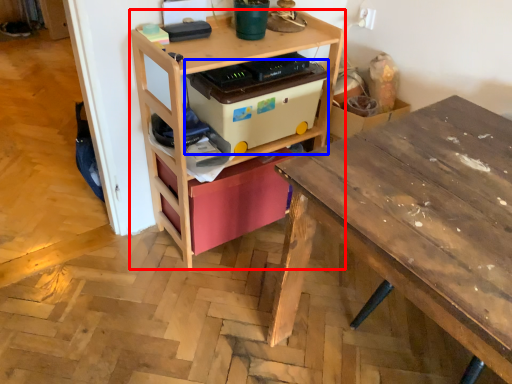
Question: Which of the following is the closest to the observer, shelf (highlighted by a red box) or storage box (highlighted by a blue box)?

Choices:
 (A) shelf
 (B) storage box

Answer: (A)